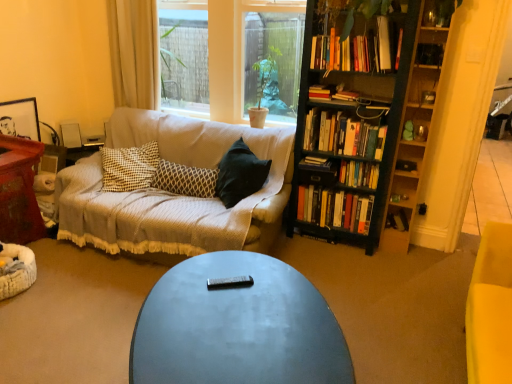
Where is `clear glass window at center`? This screenshot has height=384, width=512. clear glass window at center is located at coordinates (232, 58).

You are a GUI agent. You are given a task and a screenshot of the screen. Output one action in this format:
    pyautogui.click(x=<x>, y=<y>)
    Task: Click on the hardcover book at upper center, arranged as the sixth book when ordered from the bottom
    This screenshot has height=384, width=512.
    Given the screenshot: What is the action you would take?
    pyautogui.click(x=345, y=96)

Considering the relative sizes of black wood bookcase at right and hardcover book at center, which appears as the fourth book when ordered from the bottom, in the image provided, is black wood bookcase at right smaller than hardcover book at center, which appears as the fourth book when ordered from the bottom,?

No.

Which is correct: black wood bookcase at right is inside hardcover book at center, which is the fifth book in top-to-bottom order, or outside of it?

black wood bookcase at right is spatially situated outside hardcover book at center, which is the fifth book in top-to-bottom order.

Considering the sizes of objects black wood bookcase at right and hardcover book at center, which is the fifth book in top-to-bottom order, in the image provided, who is taller, black wood bookcase at right or hardcover book at center, which is the fifth book in top-to-bottom order,?

black wood bookcase at right is taller.

Is black wood bookcase at right to the left or to the right of hardcover book at center, which appears as the fourth book when ordered from the bottom, in the image?

In the image, black wood bookcase at right appears on the right side of hardcover book at center, which appears as the fourth book when ordered from the bottom.

Is point (157, 174) positioned after point (327, 90)?

Yes, it is behind point (327, 90).

Can hardcover book at upper center, which ranks as the 2th book in top-to-bottom order, be found inside patterned fabric pillow at center?

Actually, hardcover book at upper center, which ranks as the 2th book in top-to-bottom order, is outside patterned fabric pillow at center.

Considering the sizes of patterned fabric pillow at center and hardcover book at upper center, which ranks as the 2th book in top-to-bottom order, in the image, is patterned fabric pillow at center wider or thinner than hardcover book at upper center, which ranks as the 2th book in top-to-bottom order,?

In the image, patterned fabric pillow at center appears to be more narrow than hardcover book at upper center, which ranks as the 2th book in top-to-bottom order.

Considering the sizes of objects patterned fabric pillow at center and hardcover book at upper center, which ranks as the 2th book in top-to-bottom order, in the image provided, who is shorter, patterned fabric pillow at center or hardcover book at upper center, which ranks as the 2th book in top-to-bottom order,?

hardcover book at upper center, which ranks as the 2th book in top-to-bottom order.

From the image's perspective, is patterned fabric pillow at center above or below hardcover book at center, which appears as the fourth book when ordered from the bottom?

From the image's perspective, patterned fabric pillow at center appears below hardcover book at center, which appears as the fourth book when ordered from the bottom.

Based on the photo, is patterned fabric pillow at center spatially inside hardcover book at center, which is the fifth book in top-to-bottom order, or outside of it?

patterned fabric pillow at center is located beyond the bounds of hardcover book at center, which is the fifth book in top-to-bottom order.

Is patterned fabric pillow at center directly adjacent to hardcover book at center, which appears as the fourth book when ordered from the bottom?

No, patterned fabric pillow at center is not in contact with hardcover book at center, which appears as the fourth book when ordered from the bottom.

Considering their positions, is patterned fabric pillow at center located in front of or behind hardcover book at center, which is the fifth book in top-to-bottom order?

In the image, patterned fabric pillow at center appears in front of hardcover book at center, which is the fifth book in top-to-bottom order.

Image resolution: width=512 pixels, height=384 pixels. Find the location of `loudspeaker that is on the left side of hardcover book at center, which is the fifth book in top-to-bottom order`. loudspeaker that is on the left side of hardcover book at center, which is the fifth book in top-to-bottom order is located at coordinates (71, 135).

From the image's perspective, which is above, hardcover book at center, which appears as the fourth book when ordered from the bottom, or white plastic speaker at upper left?

white plastic speaker at upper left.

Considering the relative sizes of hardcover book at center, which appears as the fourth book when ordered from the bottom, and white plastic speaker at upper left in the image provided, is hardcover book at center, which appears as the fourth book when ordered from the bottom, taller than white plastic speaker at upper left?

No, hardcover book at center, which appears as the fourth book when ordered from the bottom, is not taller than white plastic speaker at upper left.

Is hardcover book at center, which appears as the fourth book when ordered from the bottom, beside hardcover book at upper center, which ranks as the 2th book in top-to-bottom order?

No, hardcover book at center, which appears as the fourth book when ordered from the bottom, is not next to hardcover book at upper center, which ranks as the 2th book in top-to-bottom order.

Is hardcover book at center, which appears as the fourth book when ordered from the bottom, closer to camera compared to hardcover book at upper center, which ranks as the 2th book in top-to-bottom order?

No, the depth of hardcover book at center, which appears as the fourth book when ordered from the bottom, is greater than that of hardcover book at upper center, which ranks as the 2th book in top-to-bottom order.

Looking at this image, is hardcover book at upper center, which ranks as the 2th book in top-to-bottom order, at the back of hardcover book at center, which is the fifth book in top-to-bottom order?

No.

Is point (312, 159) farther from camera compared to point (314, 95)?

Yes, it is behind point (314, 95).

From a real-world perspective, between hardcover book at upper center, which ranks as the third book in top-to-bottom order, and black wood bookcase at right, who is vertically lower?

black wood bookcase at right, from a real-world perspective.

Is hardcover book at upper center, arranged as the sixth book when ordered from the bottom, oriented away from black wood bookcase at right?

Absolutely, hardcover book at upper center, arranged as the sixth book when ordered from the bottom, is directed away from black wood bookcase at right.

Which of these two, hardcover book at upper center, which ranks as the third book in top-to-bottom order, or black wood bookcase at right, stands taller?

Standing taller between the two is black wood bookcase at right.

Which is closer to the camera, (349, 95) or (334, 121)?

The point (349, 95) is closer.

Considering the sizes of objects green matte plant at center and wooden side table at left in the image provided, who is smaller, green matte plant at center or wooden side table at left?

With smaller size is wooden side table at left.

Consider the image. Is the position of green matte plant at center more distant than that of wooden side table at left?

That is False.

Where is `side table that appears below the green matte plant at center (from the image's perspective)`? This screenshot has height=384, width=512. side table that appears below the green matte plant at center (from the image's perspective) is located at coordinates (69, 154).

Could you tell me if green matte plant at center is turned towards wooden side table at left?

No.

Where is `bookcase above the hardcover book at center, which appears as the fourth book when ordered from the bottom (from a real-world perspective)`? bookcase above the hardcover book at center, which appears as the fourth book when ordered from the bottom (from a real-world perspective) is located at coordinates (364, 123).

Identify the location of pillow below the hardcover book at upper center, which ranks as the 2th book in top-to-bottom order (from a real-world perspective). (185, 179).

Based on their spatial positions, is hardcover books at right, the 7th book in the top-to-bottom sequence, or white plastic speaker at upper left further from clear glass window at center?

white plastic speaker at upper left lies further to clear glass window at center than the other object.

Estimate the real-world distances between objects in this image. Which object is closer to hardcover book at center, which appears as the fourth book when ordered from the bottom, white matte book at lower right, which is counted as the eighth book, starting from the top, or hardcover books at right, the 2th book when ordered from bottom to top?

The object closer to hardcover book at center, which appears as the fourth book when ordered from the bottom, is hardcover books at right, the 2th book when ordered from bottom to top.

When comparing their distances from yellow fabric curtain at upper left, does clear glass window at center or hardcover book at upper center, arranged as the sixth book when ordered from the bottom, seem further?

hardcover book at upper center, arranged as the sixth book when ordered from the bottom, lies further to yellow fabric curtain at upper left than the other object.

Looking at the image, which one is located closer to clear glass window at center, hardcover books at upper right, which ranks as the eighth book in bottom-to-top order, or hardcover book at upper center, which ranks as the third book in top-to-bottom order?

The object closer to clear glass window at center is hardcover books at upper right, which ranks as the eighth book in bottom-to-top order.

From the image, which object appears to be nearer to black wood bookcase at right, matte black coffee table at center or hardcover books at right, the 7th book in the top-to-bottom sequence?

hardcover books at right, the 7th book in the top-to-bottom sequence.

From the image, which object appears to be nearer to black wood bookcase at right, wooden table at left or patterned fabric pillow at center?

Among the two, patterned fabric pillow at center is located nearer to black wood bookcase at right.

From the image, which object appears to be farther from wooden table at left, hardcover books at upper right, which appears as the first book when viewed from the top, or matte black coffee table at center?

hardcover books at upper right, which appears as the first book when viewed from the top, is further to wooden table at left.

Estimate the real-world distances between objects in this image. Which object is further from white matte book at lower right, which is counted as the eighth book, starting from the top, hardcover books at right, the 4th book when ordered from top to bottom, or black wood bookcase at right?

black wood bookcase at right is positioned further to the anchor white matte book at lower right, which is counted as the eighth book, starting from the top.

At what (x,y) coordinates should I click in order to perform the action: click on pillow between wooden side table at left and hardcover book at center, which appears as the fourth book when ordered from the bottom. Please return your answer as a coordinate pair (x, y). Looking at the image, I should click on (185, 179).

Where is `houseplant between wooden table at left and hardcover books at center-right, marked as the third book in a bottom-to-top arrangement, from left to right`? houseplant between wooden table at left and hardcover books at center-right, marked as the third book in a bottom-to-top arrangement, from left to right is located at coordinates (265, 87).

Find the location of a particular element. The image size is (512, 384). window between matte black coffee table at center and white plastic speaker at upper left in the front-back direction is located at coordinates (232, 58).

The width and height of the screenshot is (512, 384). I want to click on loudspeaker between wooden table at left and black wood bookcase at right in the horizontal direction, so click(x=71, y=135).